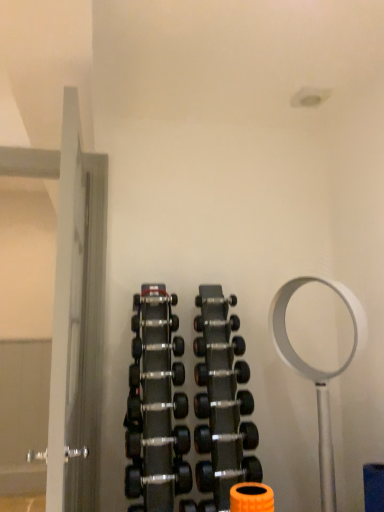
Question: From the image's perspective, is black rubber dumbbell at center, arranged as the 4th dumbbell when ordered from the bottom, located above or below black rubber dumbbell at center, the 2th dumbbell from the bottom?

Choices:
 (A) below
 (B) above

Answer: (B)

Question: Do you think black rubber dumbbell at center, marked as the eighth dumbbell in a top-to-bottom arrangement, is within black rubber dumbbell at center, the 10th dumbbell viewed from the top, or outside of it?

Choices:
 (A) outside
 (B) inside

Answer: (A)

Question: Based on their relative distances, which object is farther from the black rubber dumbbell at center, the tenth dumbbell positioned from the bottom?

Choices:
 (A) black rubber dumbbell at center, acting as the 5th dumbbell starting from the bottom
 (B) black rubber dumbbell at center, acting as the ninth dumbbell starting from the top
 (C) black rubber dumbbell at center, the 8th dumbbell from the bottom
 (D) polished silver dumbbell at center, placed as the first dumbbell when sorted from top to bottom
 (E) black rubber dumbbell at center, the 2th dumbbell from the bottom

Answer: (E)

Question: Which object is the closest to the black rubber dumbbell at center, the ninth dumbbell from the bottom?

Choices:
 (A) black rubber dumbbell at center, marked as the 7th dumbbell in a bottom-to-top arrangement
 (B) black rubber dumbbell at center, the third dumbbell when ordered from bottom to top
 (C) black rubber dumbbell at center, acting as the 5th dumbbell starting from the bottom
 (D) black rubber dumbbell at center, the tenth dumbbell positioned from the bottom
 (E) black rubber dumbbell at center, marked as the eighth dumbbell in a top-to-bottom arrangement

Answer: (A)